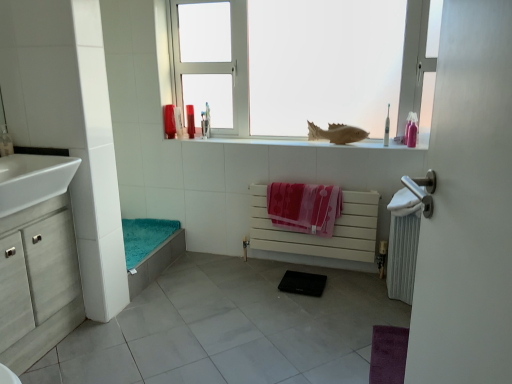
Find the location of `free space that is to the left of pink plastic toothbrush at upper right, the 2th toiletry from the right`. free space that is to the left of pink plastic toothbrush at upper right, the 2th toiletry from the right is located at coordinates (365, 140).